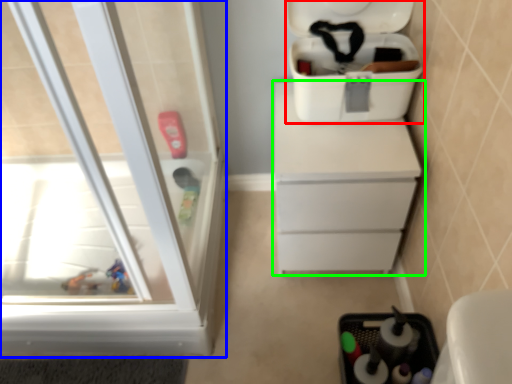
Question: Which is nearer to the cooler (highlighted by a red box)? screen door (highlighted by a blue box) or chest of drawers (highlighted by a green box).

Choices:
 (A) screen door
 (B) chest of drawers

Answer: (B)